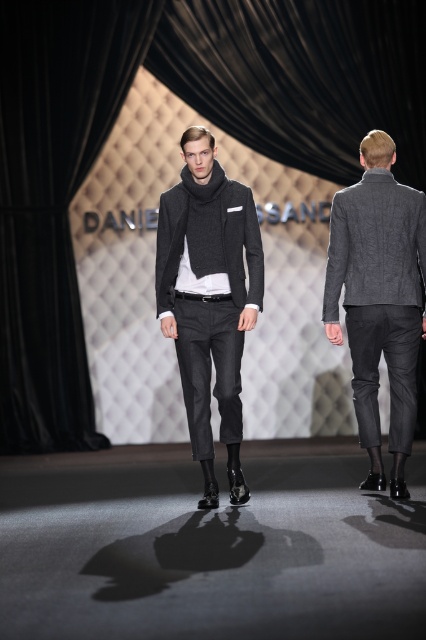
Is black velvet curtain at left wider than matte gray sweater at center?

Correct, the width of black velvet curtain at left exceeds that of matte gray sweater at center.

Does black velvet curtain at left have a lesser width compared to matte gray sweater at center?

No.

The image size is (426, 640). Find the location of `black velvet curtain at left`. black velvet curtain at left is located at coordinates (54, 200).

Can you confirm if black velvet curtain at left is positioned to the right of textured gray blazer at right?

Incorrect, black velvet curtain at left is not on the right side of textured gray blazer at right.

Does black velvet curtain at left appear on the left side of textured gray blazer at right?

Yes, black velvet curtain at left is to the left of textured gray blazer at right.

Measure the distance between point (36,68) and camera.

Point (36,68) and camera are 7.17 meters apart from each other.

You are a GUI agent. You are given a task and a screenshot of the screen. Output one action in this format:
    pyautogui.click(x=<x>, y=<y>)
    Task: Click on the black velvet curtain at left
    This screenshot has height=640, width=426.
    Given the screenshot: What is the action you would take?
    pyautogui.click(x=54, y=200)

Which is in front, point (199, 289) or point (365, 368)?

Point (199, 289) is in front.

At what (x,y) coordinates should I click in order to perform the action: click on matte gray sweater at center. Please return your answer as a coordinate pair (x, y). Looking at the image, I should click on (209, 298).

Who is more forward, (210, 445) or (354, 384)?

Positioned in front is point (210, 445).

The image size is (426, 640). I want to click on matte gray sweater at center, so click(x=209, y=298).